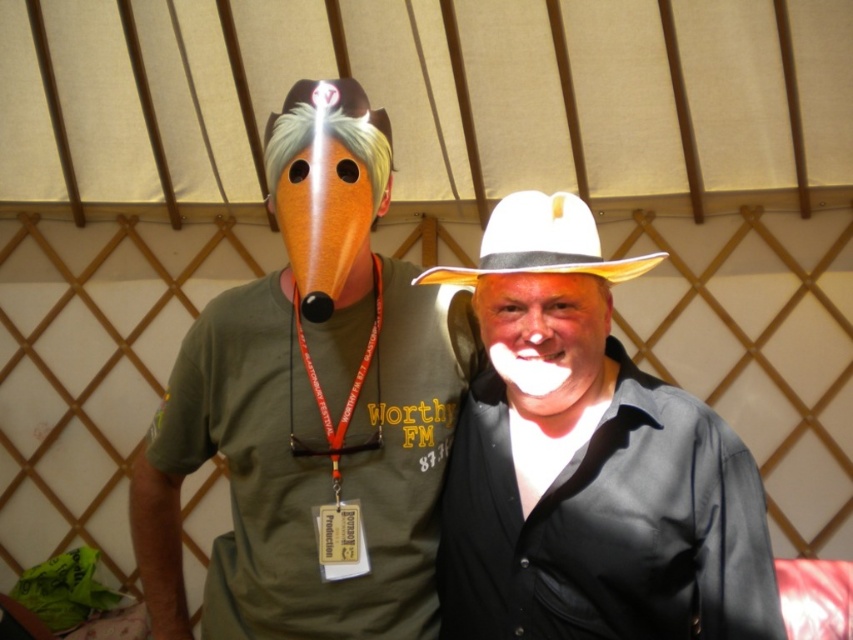
You are designing a display stand for a gift shop that needs to accommodate both the matte orange mask at center and the white felt cowboy hat at center. The stand has a shelf with a width of 1 meter. If you want to place both items side by side without overlapping, will they fit? Please consider their widths as described.

The matte orange mask at center is wider than the white felt cowboy hat at center. Since the shelf is 1 meter wide, and the mask alone is already wider than the hat, but the total combined width of both items must be less than or equal to 1 meter. However, without exact measurements, we can infer that if the mask is larger, placing both side by side may exceed the shelf width. Therefore, they might not fit together without overlapping.

Based on the photo, you are a photographer setting up for a group photo inside the yurt. You need to ensure that both the matte orange mask at center and the white matte cowboy hat at center are clearly visible in the frame. Considering their sizes, which object should you focus on first to avoid blurring due to their relative heights?

The matte orange mask at center is taller than the white matte cowboy hat at center, so you should focus on the matte orange mask at center first to ensure clarity since it occupies more space in the frame.